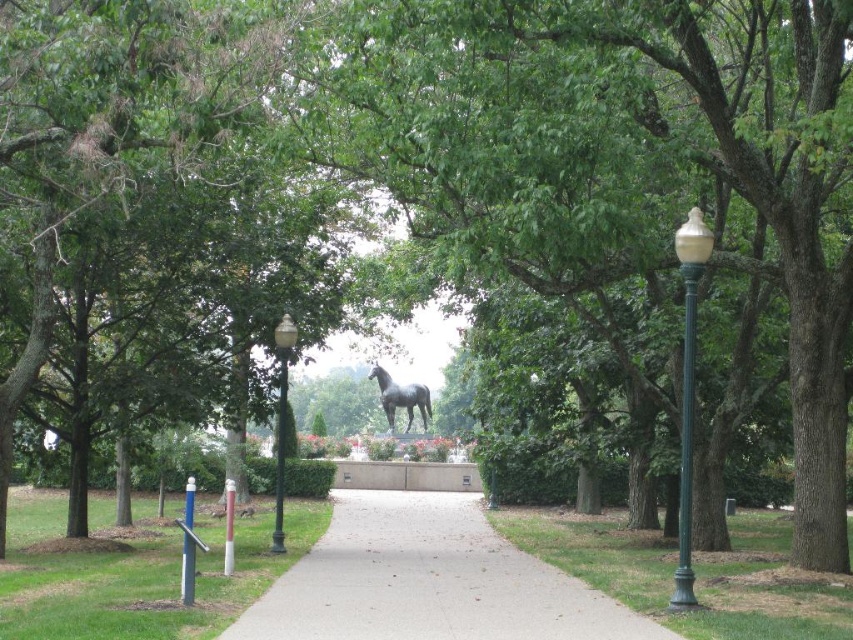
You are a gardener who needs to place a new 2x2 foot square planter in the park. You see the gray concrete pavement at center and the green matte lamp post at center. Which location has enough space to accommodate the planter without blocking the pathway?

The gray concrete pavement at center has a larger width than the green matte lamp post at center, so placing the planter on the gray concrete pavement at center would provide sufficient space without obstructing the pathway.

You are a gardener with a 3.14 meter long hose. You need to water the gray concrete pavement at center and the green matte lamp post at center. Can your hose reach both areas from your current position?

The distance between the gray concrete pavement at center and the green matte lamp post at center is 3.14 meters, so the 3.14 meter long hose can just barely reach both areas if positioned correctly between them.

You are standing at the entrance of the park and see the shiny black statue at center. If you walk straight ahead along the pathway, will you reach the statue before the pathway ends?

The shiny black statue at center is positioned at point (x=399, y=397), which is along the pathway leading towards it. Since the pathway leads directly to the statue, walking straight ahead along the pathway will indeed lead you to the statue before the pathway ends.